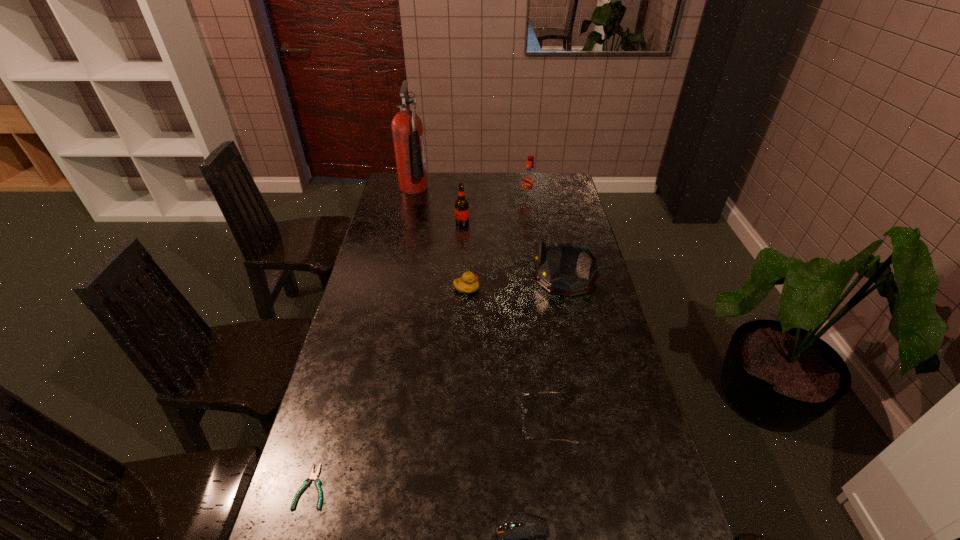
Image resolution: width=960 pixels, height=540 pixels. What are the coordinates of `fire extinguisher present at the far edge` in the screenshot? It's located at (407, 129).

I want to click on root beer that is at the far edge, so click(x=529, y=179).

This screenshot has height=540, width=960. Find the location of `fire extinguisher present at the left edge`. fire extinguisher present at the left edge is located at coordinates (407, 129).

Find the location of `pliers that is at the left edge`. pliers that is at the left edge is located at coordinates (313, 476).

Find the location of a particular element. This screenshot has width=960, height=540. object situated at the right edge is located at coordinates (571, 252).

The height and width of the screenshot is (540, 960). I want to click on object that is at the far left corner, so click(x=407, y=129).

What are the coordinates of `vacant space at the left edge` in the screenshot? It's located at (372, 282).

In the image, there is a desktop. In order to click on vacant space at the right edge in this screenshot , I will do `click(575, 262)`.

Identify the location of vacant space at the far right corner of the desktop. Image resolution: width=960 pixels, height=540 pixels. (549, 178).

Identify the location of vacant point located between the tiara and the spectacles. This screenshot has width=960, height=540. (556, 350).